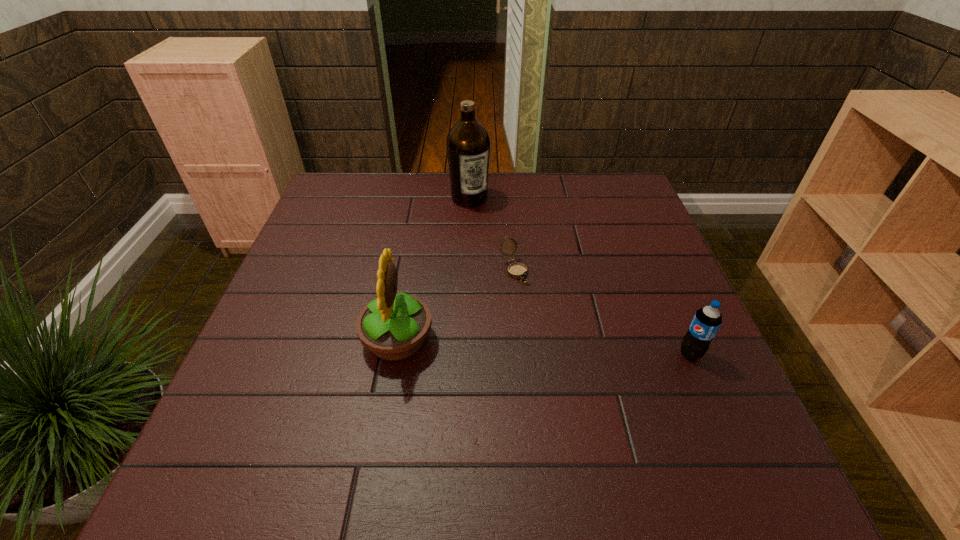
The height and width of the screenshot is (540, 960). In order to click on vacant spot on the desktop that is between the third shortest object and the soda bottle and is positioned on the label of the second object from left to right in this screenshot , I will do `click(564, 348)`.

Find the location of a particular element. Image resolution: width=960 pixels, height=540 pixels. vacant space on the desktop that is between the second tallest object and the soda bottle and is positioned on the face of the second object from right to left is located at coordinates (568, 348).